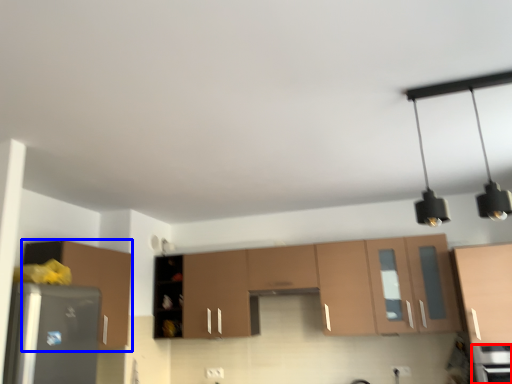
Question: Which point is closer to the camera, appliance (highlighted by a red box) or cabinetry (highlighted by a blue box)?

Choices:
 (A) appliance
 (B) cabinetry

Answer: (A)